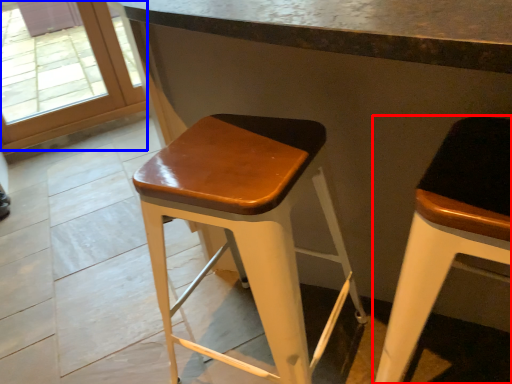
Question: Which object appears farthest to the camera in this image, stool (highlighted by a red box) or glass door (highlighted by a blue box)?

Choices:
 (A) stool
 (B) glass door

Answer: (B)